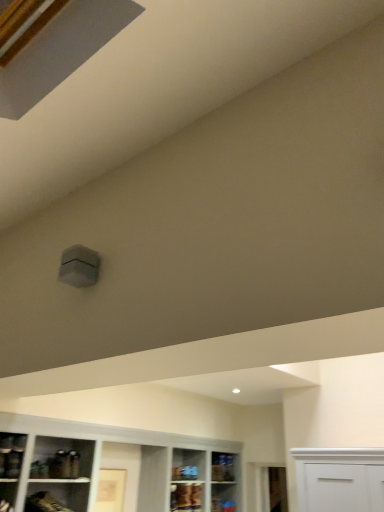
Question: From the image's perspective, is matte brown cabinet at lower center located above clear glass shelf at lower center, the 1th shelf when ordered from back to front?

Choices:
 (A) no
 (B) yes

Answer: (B)

Question: Can clear glass shelf at lower center, placed as the 1th shelf when sorted from right to left, be found inside matte brown cabinet at lower center?

Choices:
 (A) no
 (B) yes

Answer: (A)

Question: Considering the relative sizes of matte brown cabinet at lower center and clear glass shelf at lower center, the 1th shelf when ordered from back to front, in the image provided, is matte brown cabinet at lower center thinner than clear glass shelf at lower center, the 1th shelf when ordered from back to front,?

Choices:
 (A) yes
 (B) no

Answer: (B)

Question: Is matte brown cabinet at lower center facing towards clear glass shelf at lower center, the 3th shelf when ordered from front to back?

Choices:
 (A) no
 (B) yes

Answer: (A)

Question: Considering the relative positions of matte brown cabinet at lower center and clear glass shelf at lower center, the 3th shelf when ordered from front to back, in the image provided, is matte brown cabinet at lower center to the right of clear glass shelf at lower center, the 3th shelf when ordered from front to back, from the viewer's perspective?

Choices:
 (A) yes
 (B) no

Answer: (B)

Question: Would you say matte brown cabinet at lower center is to the left or to the right of matte glass shelf at lower left, arranged as the first shelf when viewed from the front, in the picture?

Choices:
 (A) right
 (B) left

Answer: (A)

Question: From the image's perspective, relative to matte glass shelf at lower left, acting as the first shelf starting from the top, is matte brown cabinet at lower center above or below?

Choices:
 (A) above
 (B) below

Answer: (B)

Question: From a real-world perspective, relative to matte glass shelf at lower left, which is the third shelf from back to front, is matte brown cabinet at lower center vertically above or below?

Choices:
 (A) above
 (B) below

Answer: (B)

Question: In terms of size, does matte brown cabinet at lower center appear bigger or smaller than matte glass shelf at lower left, which appears as the first shelf when viewed from the left?

Choices:
 (A) small
 (B) big

Answer: (B)

Question: From the image's perspective, relative to matte brown shelf at lower left, the second shelf when ordered from top to bottom, is matte brown cabinet at lower center above or below?

Choices:
 (A) above
 (B) below

Answer: (B)

Question: Is matte brown cabinet at lower center to the left or to the right of matte brown shelf at lower left, the second shelf when ordered from top to bottom, in the image?

Choices:
 (A) right
 (B) left

Answer: (A)

Question: In terms of width, does matte brown cabinet at lower center look wider or thinner when compared to matte brown shelf at lower left, the second shelf when ordered from front to back?

Choices:
 (A) wide
 (B) thin

Answer: (B)

Question: Is matte brown cabinet at lower center bigger or smaller than matte brown shelf at lower left, the second shelf when ordered from top to bottom?

Choices:
 (A) big
 (B) small

Answer: (B)

Question: Is matte brown shelf at lower left, which is the 2th shelf from bottom to top, bigger or smaller than clear glass shelf at lower center, the 3th shelf when ordered from front to back?

Choices:
 (A) small
 (B) big

Answer: (B)

Question: From a real-world perspective, relative to clear glass shelf at lower center, the 3th shelf when ordered from front to back, is matte brown shelf at lower left, which appears as the second shelf when viewed from the right, vertically above or below?

Choices:
 (A) below
 (B) above

Answer: (A)